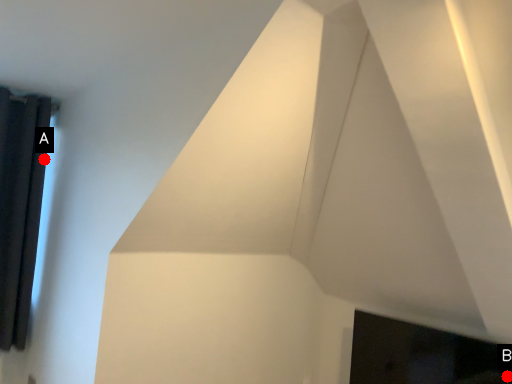
Question: Two points are circled on the image, labeled by A and B beside each circle. Which point is closer to the camera taking this photo?

Choices:
 (A) A is closer
 (B) B is closer

Answer: (B)